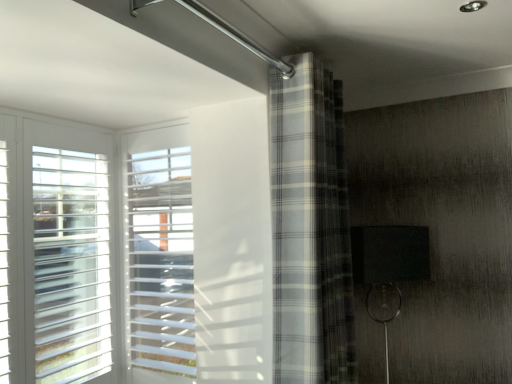
Question: In terms of size, does gray plaid curtain at center appear bigger or smaller than white plastic blinds at left?

Choices:
 (A) small
 (B) big

Answer: (B)

Question: Is point (307, 299) positioned closer to the camera than point (121, 157)?

Choices:
 (A) farther
 (B) closer

Answer: (B)

Question: Considering their positions, is gray plaid curtain at center located in front of or behind white plastic blinds at left?

Choices:
 (A) behind
 (B) front

Answer: (B)

Question: Visually, is white plastic blinds at left positioned to the left or to the right of gray plaid curtain at center?

Choices:
 (A) right
 (B) left

Answer: (B)

Question: From a real-world perspective, relative to gray plaid curtain at center, is white plastic blinds at left vertically above or below?

Choices:
 (A) above
 (B) below

Answer: (B)

Question: Relative to gray plaid curtain at center, is white plastic blinds at left in front or behind?

Choices:
 (A) front
 (B) behind

Answer: (B)

Question: From the image's perspective, is white plastic blinds at left located above or below gray plaid curtain at center?

Choices:
 (A) below
 (B) above

Answer: (A)